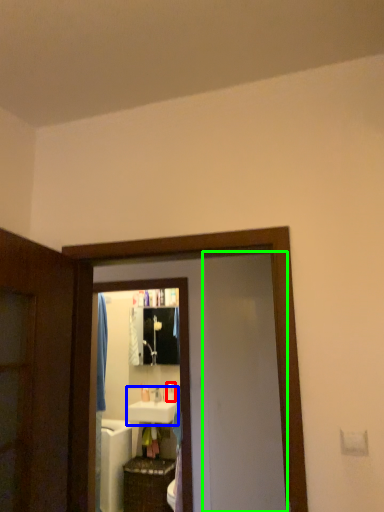
Question: Which is nearer to the toiletry (highlighted by a red box)? sink (highlighted by a blue box) or screen door (highlighted by a green box).

Choices:
 (A) sink
 (B) screen door

Answer: (A)